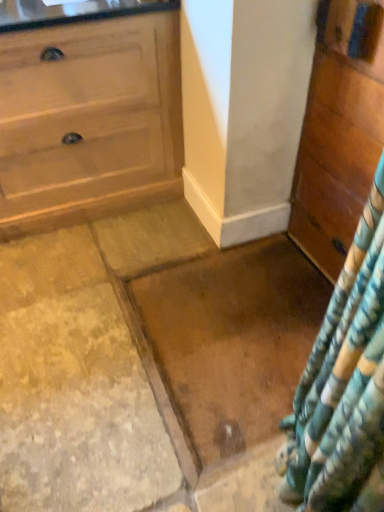
Question: Would you say wooden chest of drawers at right is to the left or to the right of brown polished granite at center in the picture?

Choices:
 (A) left
 (B) right

Answer: (B)

Question: Considering the positions of point (309, 179) and point (258, 246), is point (309, 179) closer or farther from the camera than point (258, 246)?

Choices:
 (A) farther
 (B) closer

Answer: (B)

Question: From their relative heights in the image, would you say wooden chest of drawers at right is taller or shorter than brown polished granite at center?

Choices:
 (A) tall
 (B) short

Answer: (A)

Question: In terms of width, does brown polished granite at center look wider or thinner when compared to wooden chest of drawers at right?

Choices:
 (A) wide
 (B) thin

Answer: (A)

Question: Which is correct: brown polished granite at center is inside wooden chest of drawers at right, or outside of it?

Choices:
 (A) outside
 (B) inside

Answer: (A)

Question: In the image, is brown polished granite at center positioned in front of or behind wooden chest of drawers at right?

Choices:
 (A) behind
 (B) front

Answer: (A)

Question: From a real-world perspective, is brown polished granite at center positioned above or below wooden chest of drawers at right?

Choices:
 (A) above
 (B) below

Answer: (B)